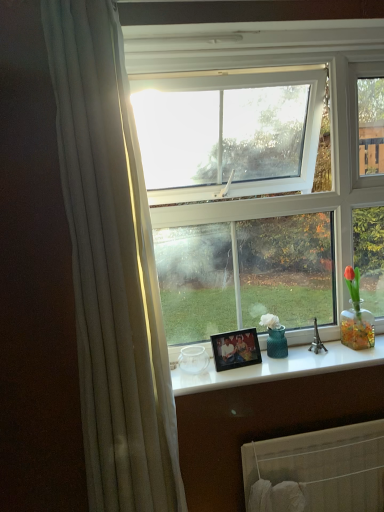
Question: Can we say white glossy counter top at center lies outside white fabric radiator at lower center?

Choices:
 (A) yes
 (B) no

Answer: (A)

Question: Are white glossy counter top at center and white fabric radiator at lower center far apart?

Choices:
 (A) yes
 (B) no

Answer: (B)

Question: Does white glossy counter top at center have a lesser height compared to white fabric radiator at lower center?

Choices:
 (A) yes
 (B) no

Answer: (A)

Question: Is white glossy counter top at center wider than white fabric radiator at lower center?

Choices:
 (A) yes
 (B) no

Answer: (A)

Question: Can you confirm if white glossy counter top at center is taller than white fabric radiator at lower center?

Choices:
 (A) yes
 (B) no

Answer: (B)

Question: Is white glossy counter top at center smaller than white fabric radiator at lower center?

Choices:
 (A) yes
 (B) no

Answer: (A)

Question: Can you confirm if white fabric radiator at lower center is smaller than wooden photo frame at center?

Choices:
 (A) yes
 (B) no

Answer: (B)

Question: Is white fabric radiator at lower center next to wooden photo frame at center and touching it?

Choices:
 (A) no
 (B) yes

Answer: (A)

Question: Is white fabric radiator at lower center positioned in front of wooden photo frame at center?

Choices:
 (A) no
 (B) yes

Answer: (B)

Question: Considering the relative sizes of white fabric radiator at lower center and wooden photo frame at center in the image provided, is white fabric radiator at lower center shorter than wooden photo frame at center?

Choices:
 (A) yes
 (B) no

Answer: (B)

Question: Is white fabric radiator at lower center not within wooden photo frame at center?

Choices:
 (A) yes
 (B) no

Answer: (A)

Question: Would you say white fabric radiator at lower center is a long distance from wooden photo frame at center?

Choices:
 (A) no
 (B) yes

Answer: (A)

Question: Does wooden photo frame at center have a smaller size compared to white fabric radiator at lower center?

Choices:
 (A) no
 (B) yes

Answer: (B)